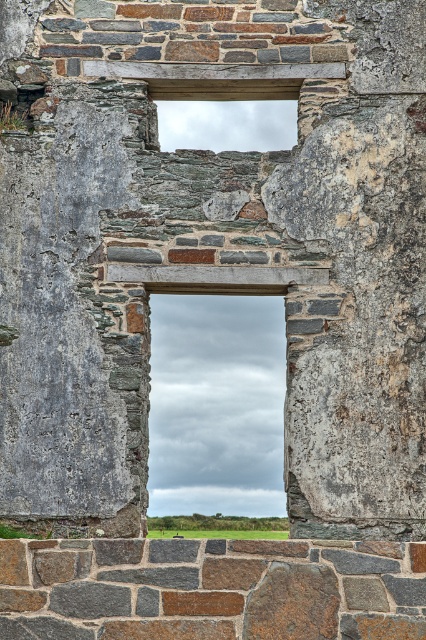
Question: Among these points, which one is nearest to the camera?

Choices:
 (A) (161, 308)
 (B) (201, 106)

Answer: (B)

Question: Which point is closer to the camera?

Choices:
 (A) (250, 330)
 (B) (271, 141)

Answer: (A)

Question: Is transparent glass window at center closer to camera compared to clear glass window at upper center?

Choices:
 (A) no
 (B) yes

Answer: (B)

Question: Does transparent glass window at center appear on the right side of clear glass window at upper center?

Choices:
 (A) yes
 (B) no

Answer: (B)

Question: Which point is closer to the camera?

Choices:
 (A) (161, 438)
 (B) (187, 108)

Answer: (B)

Question: Does transparent glass window at center have a larger size compared to clear glass window at upper center?

Choices:
 (A) yes
 (B) no

Answer: (A)